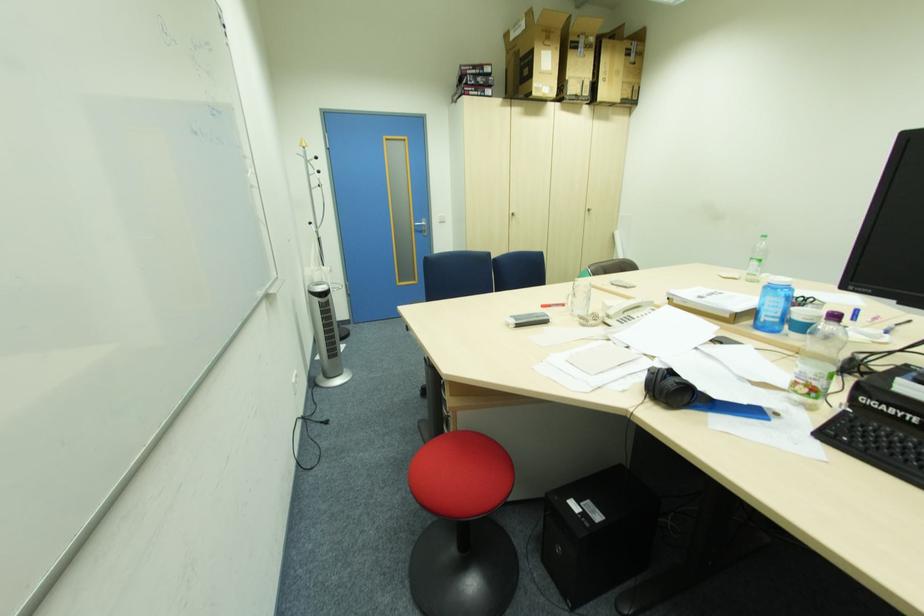
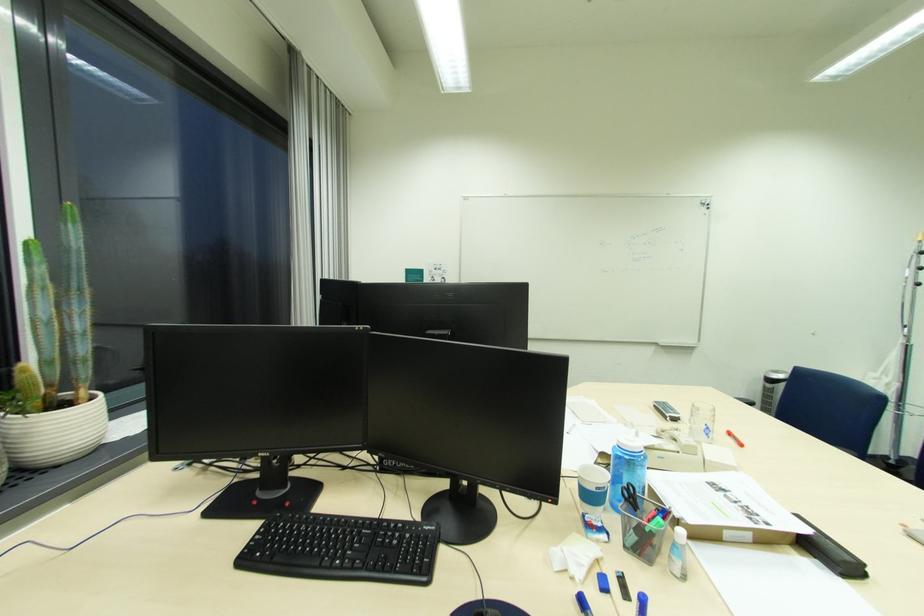
In the second image, find the point that corresponds to (x=550, y=307) in the first image.

(736, 435)